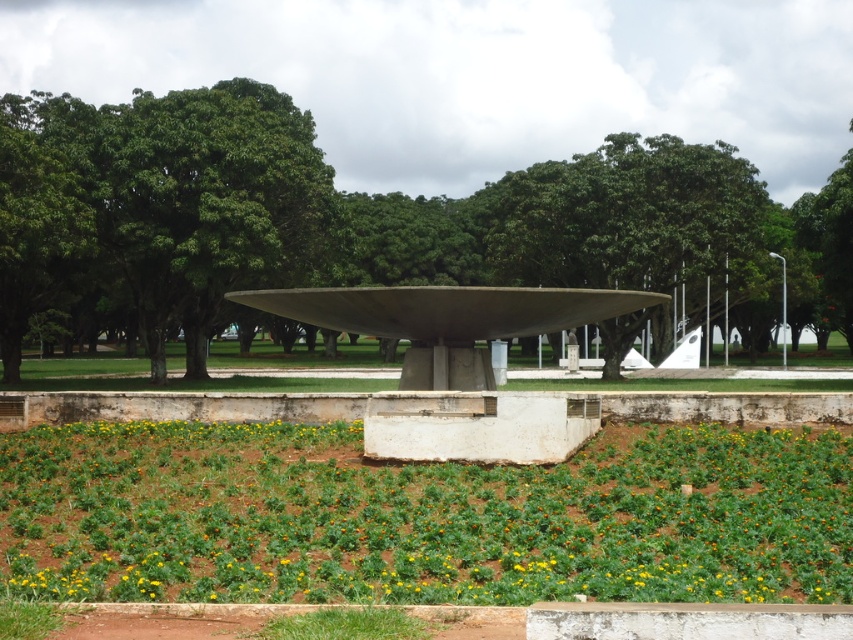
Between green leafy plant at lower center and green leafy tree at upper left, which one appears on the left side from the viewer's perspective?

green leafy tree at upper left is more to the left.

Does green leafy plant at lower center appear over green leafy tree at upper left?

No.

Is point (453, 560) more distant than point (67, 193)?

No, (453, 560) is closer to viewer.

Find the location of a particular element. The height and width of the screenshot is (640, 853). green leafy plant at lower center is located at coordinates coord(421,516).

What do you see at coordinates (357, 221) in the screenshot?
I see `green leafy tree at center` at bounding box center [357, 221].

Looking at this image, does green leafy tree at center have a greater width compared to green leafy tree at upper left?

Yes.

Who is more distant from viewer, [331,272] or [44,180]?

Positioned behind is point [331,272].

You are a GUI agent. You are given a task and a screenshot of the screen. Output one action in this format:
    pyautogui.click(x=<x>, y=<y>)
    Task: Click on the green leafy tree at center
    
    Given the screenshot: What is the action you would take?
    pyautogui.click(x=357, y=221)

Is green leafy tree at center above green leafy plant at lower center?

Answer: Indeed, green leafy tree at center is positioned over green leafy plant at lower center.

Can you confirm if green leafy tree at center is positioned below green leafy plant at lower center?

No.

Is point (90, 308) closer to viewer compared to point (758, 486)?

No, (90, 308) is behind (758, 486).

Locate an element on the screen. This screenshot has width=853, height=640. green leafy tree at center is located at coordinates (357, 221).